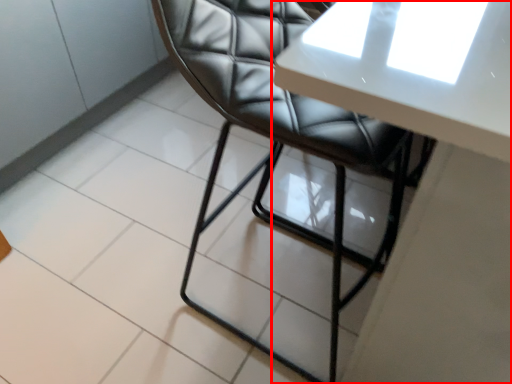
Question: Considering the relative positions of table (annotated by the red box) and chair in the image provided, where is table (annotated by the red box) located with respect to the staircase?

Choices:
 (A) left
 (B) right

Answer: (B)